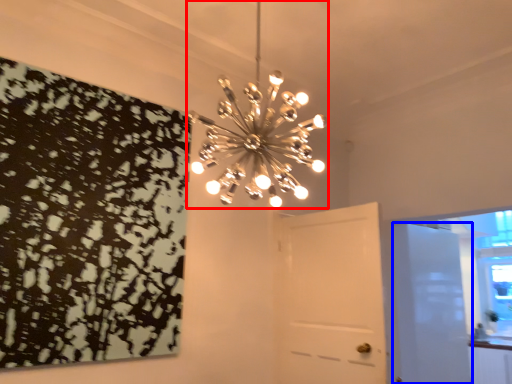
Question: Which object appears farthest to the camera in this image, lamp (highlighted by a red box) or door (highlighted by a blue box)?

Choices:
 (A) lamp
 (B) door

Answer: (B)